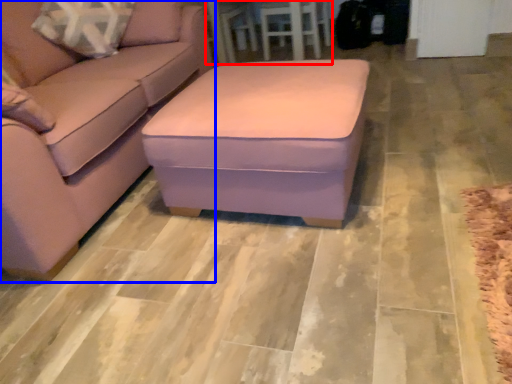
Question: Which object appears farthest to the camera in this image, table (highlighted by a red box) or studio couch (highlighted by a blue box)?

Choices:
 (A) table
 (B) studio couch

Answer: (A)